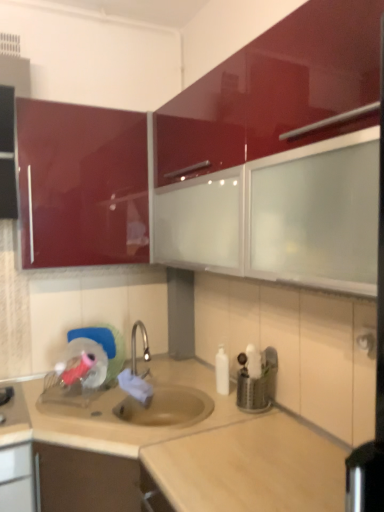
The height and width of the screenshot is (512, 384). Describe the element at coordinates (258, 384) in the screenshot. I see `metallic silver utensil holder at center` at that location.

The height and width of the screenshot is (512, 384). Identify the location of glossy red cabinet at upper left, which appears as the second cabinetry when viewed from the right. (81, 185).

Find the location of a particular element. The image size is (384, 512). glossy red cabinet at upper center, the first cabinetry positioned from the right is located at coordinates (279, 156).

Choose the correct answer: Is beige laminate countertop at center inside glossy red cabinet at upper center, which is the second cabinetry from left to right, or outside it?

beige laminate countertop at center exists outside the volume of glossy red cabinet at upper center, which is the second cabinetry from left to right.

Is beige laminate countertop at center facing towards glossy red cabinet at upper center, which is the second cabinetry from left to right?

No, beige laminate countertop at center is not oriented towards glossy red cabinet at upper center, which is the second cabinetry from left to right.

Are beige laminate countertop at center and glossy red cabinet at upper center, the first cabinetry positioned from the right, beside each other?

beige laminate countertop at center and glossy red cabinet at upper center, the first cabinetry positioned from the right, are not in contact.

Considering the positions of objects metallic silver utensil holder at center and beige laminate countertop at center in the image provided, who is in front, metallic silver utensil holder at center or beige laminate countertop at center?

beige laminate countertop at center is more forward.

Is metallic silver utensil holder at center looking in the opposite direction of beige laminate countertop at center?

No, beige laminate countertop at center is not at the back of metallic silver utensil holder at center.

Is metallic silver utensil holder at center placed right next to beige laminate countertop at center?

metallic silver utensil holder at center and beige laminate countertop at center are not in contact.

In the scene shown: Is beige laminate countertop at center bigger or smaller than glossy red cabinet at upper left, which appears as the second cabinetry when viewed from the right?

Clearly, beige laminate countertop at center is larger in size than glossy red cabinet at upper left, which appears as the second cabinetry when viewed from the right.

Can you confirm if beige laminate countertop at center is shorter than glossy red cabinet at upper left, marked as the first cabinetry in a left-to-right arrangement?

In fact, beige laminate countertop at center may be taller than glossy red cabinet at upper left, marked as the first cabinetry in a left-to-right arrangement.

From the picture: Is beige laminate countertop at center in contact with glossy red cabinet at upper left, marked as the first cabinetry in a left-to-right arrangement?

beige laminate countertop at center and glossy red cabinet at upper left, marked as the first cabinetry in a left-to-right arrangement, are clearly separated.

From a real-world perspective, is beige laminate countertop at center under glossy red cabinet at upper left, marked as the first cabinetry in a left-to-right arrangement?

Yes, from a real-world perspective, beige laminate countertop at center is under glossy red cabinet at upper left, marked as the first cabinetry in a left-to-right arrangement.

Can you confirm if glossy red cabinet at upper left, marked as the first cabinetry in a left-to-right arrangement, is wider than beige laminate countertop at center?

No.

Relative to beige laminate countertop at center, is glossy red cabinet at upper left, which appears as the second cabinetry when viewed from the right, in front or behind?

In the image, glossy red cabinet at upper left, which appears as the second cabinetry when viewed from the right, appears behind beige laminate countertop at center.

What's the angular difference between glossy red cabinet at upper left, which appears as the second cabinetry when viewed from the right, and beige laminate countertop at center's facing directions?

There is a 90.8-degree angle between the facing directions of glossy red cabinet at upper left, which appears as the second cabinetry when viewed from the right, and beige laminate countertop at center.

Considering the relative positions of glossy red cabinet at upper left, which appears as the second cabinetry when viewed from the right, and beige laminate countertop at center in the image provided, is glossy red cabinet at upper left, which appears as the second cabinetry when viewed from the right, to the right of beige laminate countertop at center from the viewer's perspective?

Incorrect, glossy red cabinet at upper left, which appears as the second cabinetry when viewed from the right, is not on the right side of beige laminate countertop at center.

Based on their sizes in the image, would you say glossy red cabinet at upper left, which appears as the second cabinetry when viewed from the right, is bigger or smaller than glossy red cabinet at upper center, which is the second cabinetry from left to right?

glossy red cabinet at upper left, which appears as the second cabinetry when viewed from the right, is smaller than glossy red cabinet at upper center, which is the second cabinetry from left to right.

From the image's perspective, would you say glossy red cabinet at upper left, which appears as the second cabinetry when viewed from the right, is positioned over glossy red cabinet at upper center, the first cabinetry positioned from the right?

Yes, from the image's perspective, glossy red cabinet at upper left, which appears as the second cabinetry when viewed from the right, is over glossy red cabinet at upper center, the first cabinetry positioned from the right.

Would you say glossy red cabinet at upper left, which appears as the second cabinetry when viewed from the right, is outside glossy red cabinet at upper center, which is the second cabinetry from left to right?

Yes, glossy red cabinet at upper left, which appears as the second cabinetry when viewed from the right, is outside of glossy red cabinet at upper center, which is the second cabinetry from left to right.

Considering the relative positions of glossy red cabinet at upper left, marked as the first cabinetry in a left-to-right arrangement, and glossy red cabinet at upper center, which is the second cabinetry from left to right, in the image provided, is glossy red cabinet at upper left, marked as the first cabinetry in a left-to-right arrangement, to the right of glossy red cabinet at upper center, which is the second cabinetry from left to right, from the viewer's perspective?

No.

Between glossy red cabinet at upper left, which appears as the second cabinetry when viewed from the right, and metallic silver utensil holder at center, which one has larger width?

Wider between the two is glossy red cabinet at upper left, which appears as the second cabinetry when viewed from the right.

Considering the positions of point (16, 106) and point (255, 381), is point (16, 106) closer or farther from the camera than point (255, 381)?

Point (16, 106) is positioned farther from the camera compared to point (255, 381).

How different are the orientations of glossy red cabinet at upper left, marked as the first cabinetry in a left-to-right arrangement, and metallic silver utensil holder at center in degrees?

The angular difference between glossy red cabinet at upper left, marked as the first cabinetry in a left-to-right arrangement, and metallic silver utensil holder at center is 89 degrees.

Is glossy red cabinet at upper left, marked as the first cabinetry in a left-to-right arrangement, positioned with its back to metallic silver utensil holder at center?

That's not correct — glossy red cabinet at upper left, marked as the first cabinetry in a left-to-right arrangement, is not looking away from metallic silver utensil holder at center.

From the image's perspective, is beige laminate countertop at center located above metallic silver utensil holder at center?

No, from the image's perspective, beige laminate countertop at center is not over metallic silver utensil holder at center.

In the image, is beige laminate countertop at center positioned in front of or behind metallic silver utensil holder at center?

beige laminate countertop at center is in front of metallic silver utensil holder at center.

Is beige laminate countertop at center oriented towards metallic silver utensil holder at center?

No, beige laminate countertop at center does not turn towards metallic silver utensil holder at center.

Where is `countertop in front of the glossy red cabinet at upper center, which is the second cabinetry from left to right`? This screenshot has height=512, width=384. countertop in front of the glossy red cabinet at upper center, which is the second cabinetry from left to right is located at coordinates (174, 450).

Locate an element on the screen. countertop below the metallic silver utensil holder at center (from the image's perspective) is located at coordinates (174, 450).

Looking at the image, which one is located closer to metallic silver utensil holder at center, beige laminate countertop at center or glossy red cabinet at upper left, marked as the first cabinetry in a left-to-right arrangement?

beige laminate countertop at center is positioned closer to the anchor metallic silver utensil holder at center.

Considering their positions, is beige laminate countertop at center positioned further to metallic silver utensil holder at center than glossy red cabinet at upper center, the first cabinetry positioned from the right?

Among the two, glossy red cabinet at upper center, the first cabinetry positioned from the right, is located further to metallic silver utensil holder at center.

When comparing their distances from metallic silver utensil holder at center, does glossy red cabinet at upper left, which appears as the second cabinetry when viewed from the right, or beige laminate countertop at center seem closer?

beige laminate countertop at center lies closer to metallic silver utensil holder at center than the other object.

Considering their positions, is beige laminate countertop at center positioned further to glossy red cabinet at upper left, which appears as the second cabinetry when viewed from the right, than glossy red cabinet at upper center, which is the second cabinetry from left to right?

beige laminate countertop at center lies further to glossy red cabinet at upper left, which appears as the second cabinetry when viewed from the right, than the other object.

Estimate the real-world distances between objects in this image. Which object is closer to glossy red cabinet at upper center, which is the second cabinetry from left to right, glossy red cabinet at upper left, which appears as the second cabinetry when viewed from the right, or metallic silver utensil holder at center?

Based on the image, glossy red cabinet at upper left, which appears as the second cabinetry when viewed from the right, appears to be nearer to glossy red cabinet at upper center, which is the second cabinetry from left to right.

When comparing their distances from glossy red cabinet at upper left, marked as the first cabinetry in a left-to-right arrangement, does glossy red cabinet at upper center, which is the second cabinetry from left to right, or beige laminate countertop at center seem further?

beige laminate countertop at center is further to glossy red cabinet at upper left, marked as the first cabinetry in a left-to-right arrangement.

Which object lies further to the anchor point glossy red cabinet at upper center, which is the second cabinetry from left to right, beige laminate countertop at center or glossy red cabinet at upper left, which appears as the second cabinetry when viewed from the right?

beige laminate countertop at center lies further to glossy red cabinet at upper center, which is the second cabinetry from left to right, than the other object.

Considering their positions, is metallic silver utensil holder at center positioned further to glossy red cabinet at upper center, the first cabinetry positioned from the right, than glossy red cabinet at upper left, marked as the first cabinetry in a left-to-right arrangement?

metallic silver utensil holder at center.

Locate an element on the screen. appliance that lies between glossy red cabinet at upper left, marked as the first cabinetry in a left-to-right arrangement, and beige laminate countertop at center from top to bottom is located at coordinates (258, 384).

Locate an element on the screen. The width and height of the screenshot is (384, 512). appliance between glossy red cabinet at upper center, which is the second cabinetry from left to right, and glossy red cabinet at upper left, which appears as the second cabinetry when viewed from the right, from front to back is located at coordinates (258, 384).

This screenshot has width=384, height=512. Identify the location of cabinetry between glossy red cabinet at upper left, which appears as the second cabinetry when viewed from the right, and beige laminate countertop at center, in the vertical direction. (279, 156).

Identify the location of appliance between glossy red cabinet at upper center, which is the second cabinetry from left to right, and beige laminate countertop at center from top to bottom. (258, 384).